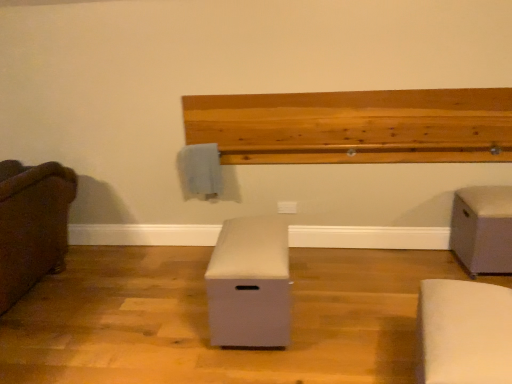
Question: From a real-world perspective, is beige fabric ottoman at right, acting as the first furniture starting from the right, on top of white fabric ottoman at lower right, acting as the 2th furniture starting from the right?

Choices:
 (A) no
 (B) yes

Answer: (B)

Question: Is beige fabric ottoman at right, which is counted as the 4th furniture, starting from the left, at the right side of white fabric ottoman at lower right, which appears as the third furniture when viewed from the left?

Choices:
 (A) no
 (B) yes

Answer: (B)

Question: Does beige fabric ottoman at right, acting as the first furniture starting from the right, turn towards white fabric ottoman at lower right, which appears as the third furniture when viewed from the left?

Choices:
 (A) no
 (B) yes

Answer: (A)

Question: Is beige fabric ottoman at right, acting as the first furniture starting from the right, surrounding white fabric ottoman at lower right, which appears as the third furniture when viewed from the left?

Choices:
 (A) yes
 (B) no

Answer: (B)

Question: From a real-world perspective, is beige fabric ottoman at right, acting as the first furniture starting from the right, physically below white fabric ottoman at lower right, which appears as the third furniture when viewed from the left?

Choices:
 (A) no
 (B) yes

Answer: (A)

Question: In terms of height, does beige fabric ottoman at right, which is counted as the 4th furniture, starting from the left, look taller or shorter compared to beige fabric ottoman at center, marked as the 2th furniture in a left-to-right arrangement?

Choices:
 (A) short
 (B) tall

Answer: (B)

Question: Is beige fabric ottoman at right, acting as the first furniture starting from the right, in front of or behind beige fabric ottoman at center, marked as the 2th furniture in a left-to-right arrangement, in the image?

Choices:
 (A) behind
 (B) front

Answer: (A)

Question: From the image's perspective, is beige fabric ottoman at right, which is counted as the 4th furniture, starting from the left, positioned above or below beige fabric ottoman at center, marked as the 2th furniture in a left-to-right arrangement?

Choices:
 (A) below
 (B) above

Answer: (B)

Question: In terms of width, does beige fabric ottoman at right, which is counted as the 4th furniture, starting from the left, look wider or thinner when compared to beige fabric ottoman at center, the 3th furniture positioned from the right?

Choices:
 (A) wide
 (B) thin

Answer: (B)

Question: Visually, is natural wood ledge at upper center positioned to the left or to the right of white fabric ottoman at lower right, which appears as the third furniture when viewed from the left?

Choices:
 (A) left
 (B) right

Answer: (A)

Question: Is natural wood ledge at upper center inside the boundaries of white fabric ottoman at lower right, acting as the 2th furniture starting from the right, or outside?

Choices:
 (A) outside
 (B) inside

Answer: (A)

Question: Based on their sizes in the image, would you say natural wood ledge at upper center is bigger or smaller than white fabric ottoman at lower right, which appears as the third furniture when viewed from the left?

Choices:
 (A) big
 (B) small

Answer: (A)

Question: Is natural wood ledge at upper center in front of or behind white fabric ottoman at lower right, acting as the 2th furniture starting from the right, in the image?

Choices:
 (A) behind
 (B) front

Answer: (A)

Question: In terms of size, does brown fabric couch at left, arranged as the fourth furniture when viewed from the right, appear bigger or smaller than beige fabric ottoman at center, the 3th furniture positioned from the right?

Choices:
 (A) small
 (B) big

Answer: (B)

Question: From their relative heights in the image, would you say brown fabric couch at left, arranged as the fourth furniture when viewed from the right, is taller or shorter than beige fabric ottoman at center, marked as the 2th furniture in a left-to-right arrangement?

Choices:
 (A) tall
 (B) short

Answer: (A)